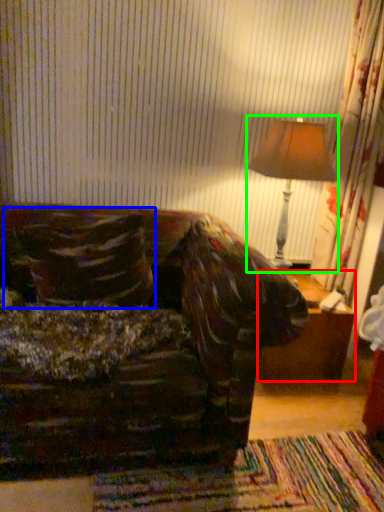
Question: Considering the real-world distances, which object is farthest from table (highlighted by a red box)? throw pillow (highlighted by a blue box) or table lamp (highlighted by a green box)?

Choices:
 (A) throw pillow
 (B) table lamp

Answer: (A)